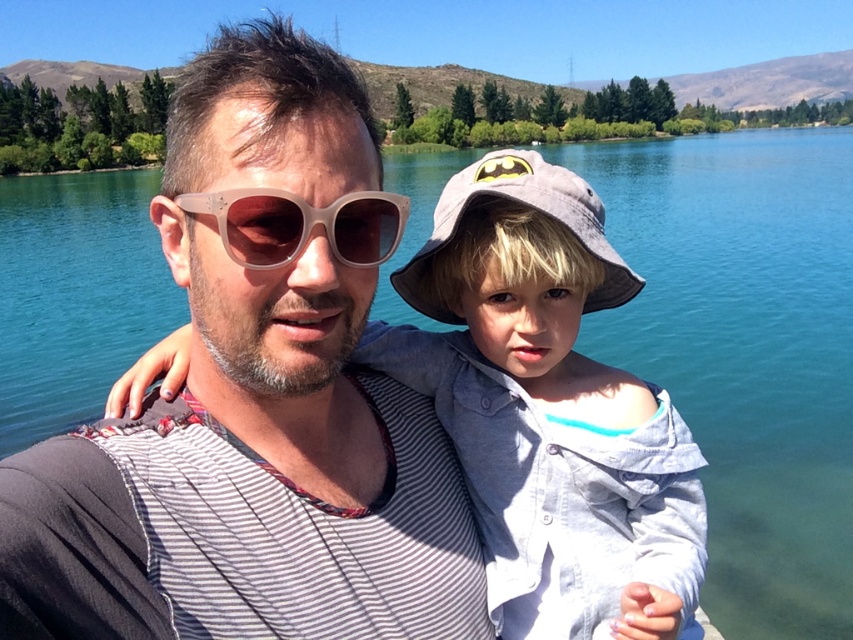
What do you see at coordinates (256, 401) in the screenshot?
I see `matte plastic sunglasses at upper center` at bounding box center [256, 401].

Is point (33, 595) positioned before point (450, 246)?

Yes, it is.

Locate an element on the screen. matte plastic sunglasses at upper center is located at coordinates (256, 401).

Is light gray cotton shirt at center positioned in front of translucent plastic sunglasses at center?

Yes, light gray cotton shirt at center is closer to the viewer.

Who is more forward, (x=489, y=440) or (x=264, y=252)?

Point (x=264, y=252) is more forward.

Locate an element on the screen. The image size is (853, 640). light gray cotton shirt at center is located at coordinates click(x=549, y=410).

In the scene shown: Between light gray cotton shirt at center and gray fabric baseball hat at center, which one has less height?

Standing shorter between the two is gray fabric baseball hat at center.

Can you confirm if light gray cotton shirt at center is positioned to the right of gray fabric baseball hat at center?

In fact, light gray cotton shirt at center is to the left of gray fabric baseball hat at center.

Is point (465, 173) positioned before point (509, 193)?

That is False.

Identify the location of light gray cotton shirt at center. (549, 410).